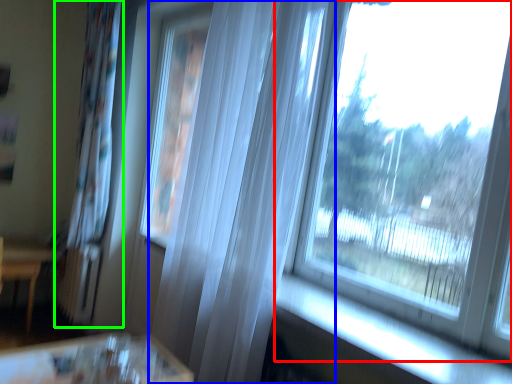
Question: Which object is the closest to the window (highlighted by a red box)? Choose among these: curtain (highlighted by a blue box) or curtain (highlighted by a green box).

Choices:
 (A) curtain
 (B) curtain

Answer: (A)